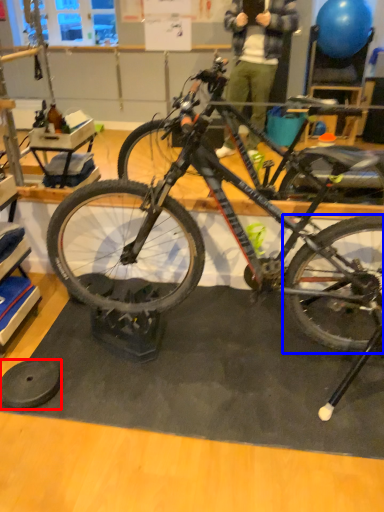
Question: Which object is further to the camera taking this photo, wheel (highlighted by a red box) or bicycle wheel (highlighted by a blue box)?

Choices:
 (A) wheel
 (B) bicycle wheel

Answer: (A)